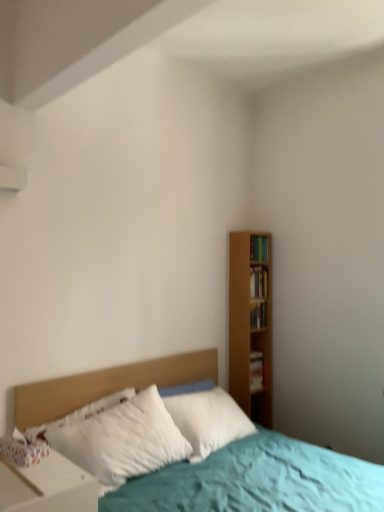
At what (x,y) coordinates should I click in order to perform the action: click on vacant region above wooden bookshelf at right, which is the fourth book from bottom to top (from a real-world perspective). Please return your answer as a coordinate pair (x, y). The width and height of the screenshot is (384, 512). Looking at the image, I should click on (258, 236).